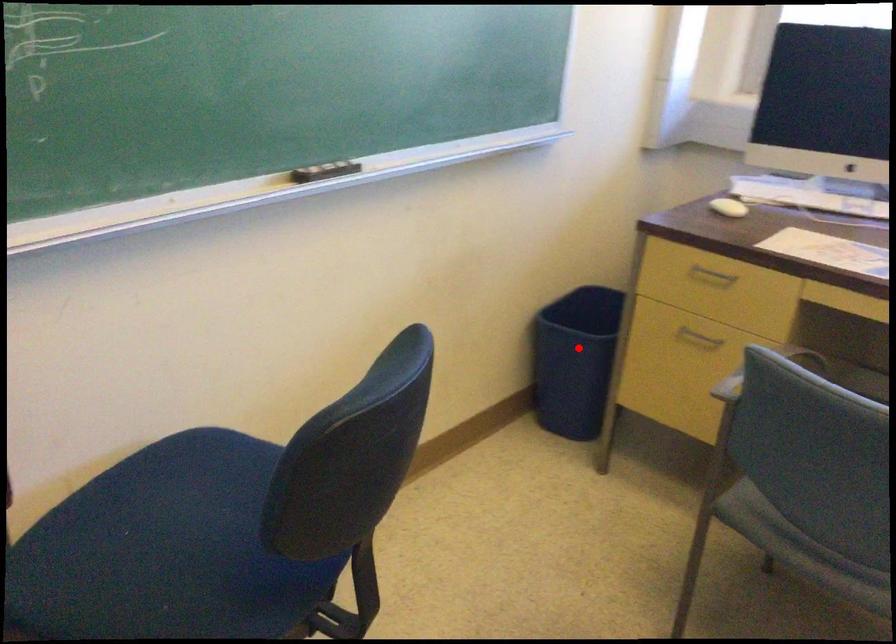
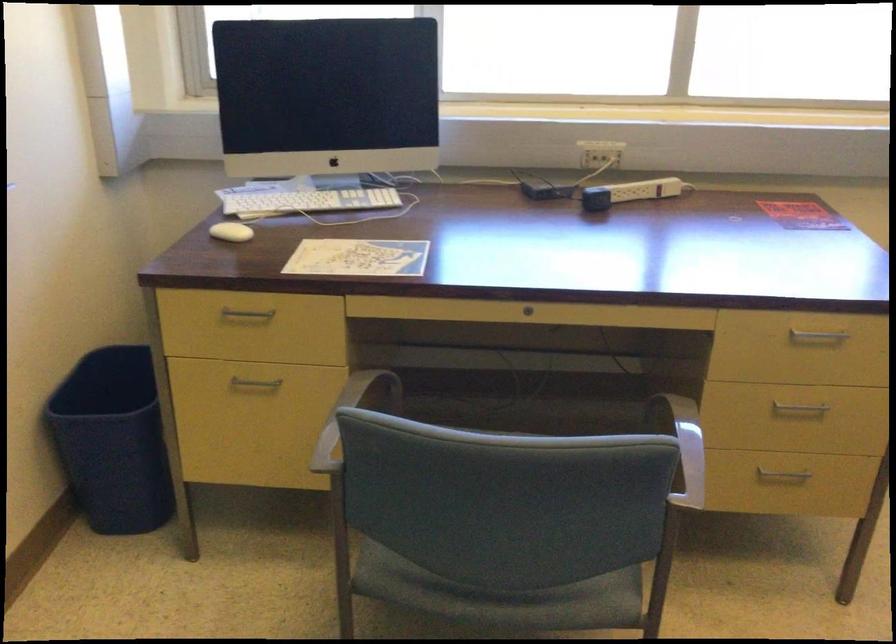
Find the pixel in the second image that matches the highlighted location in the first image.

(113, 440)